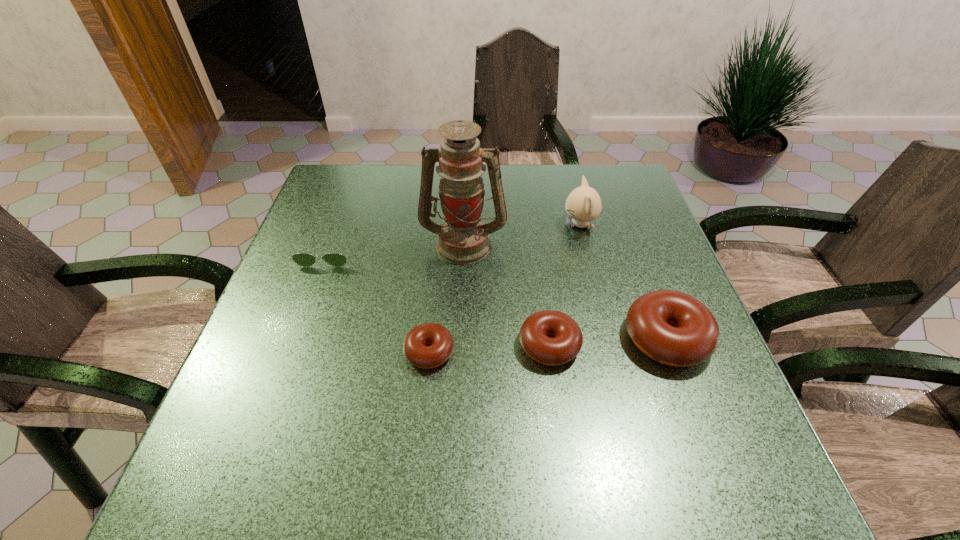
Identify the location of free spot that satisfies the following two spatial constraints: 1. on the front-facing side of the fourth object from left to right; 2. on the right side of the leftmost object. (294, 345).

Identify the location of vacant area that satisfies the following two spatial constraints: 1. on the back side of the rightmost doughnut; 2. on the face of the second tallest object. This screenshot has height=540, width=960. (624, 225).

Locate an element on the screen. free spot that satisfies the following two spatial constraints: 1. on the back side of the rightmost doughnut; 2. on the right side of the third object from right to left is located at coordinates (548, 339).